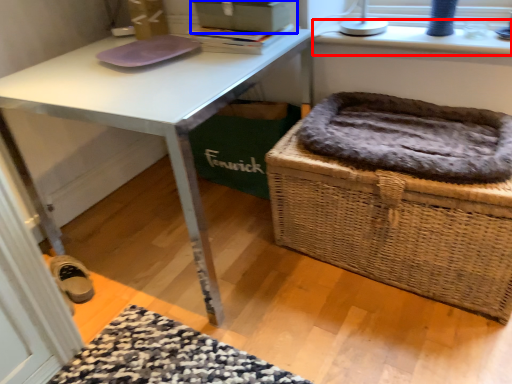
Question: Among these objects, which one is nearest to the camera, window sill (highlighted by a red box) or box (highlighted by a blue box)?

Choices:
 (A) window sill
 (B) box

Answer: (B)